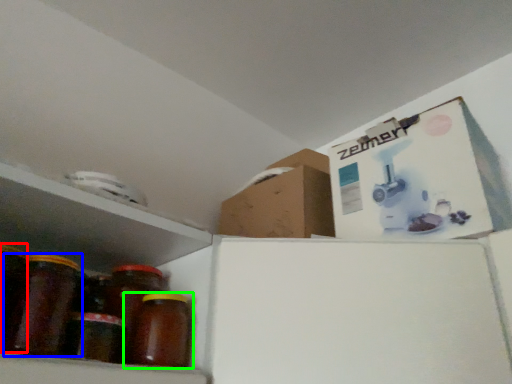
Question: Which object is positioned farthest from glass jar (highlighted by a red box)? Select from bottle (highlighted by a blue box) and bottle (highlighted by a green box).

Choices:
 (A) bottle
 (B) bottle

Answer: (B)